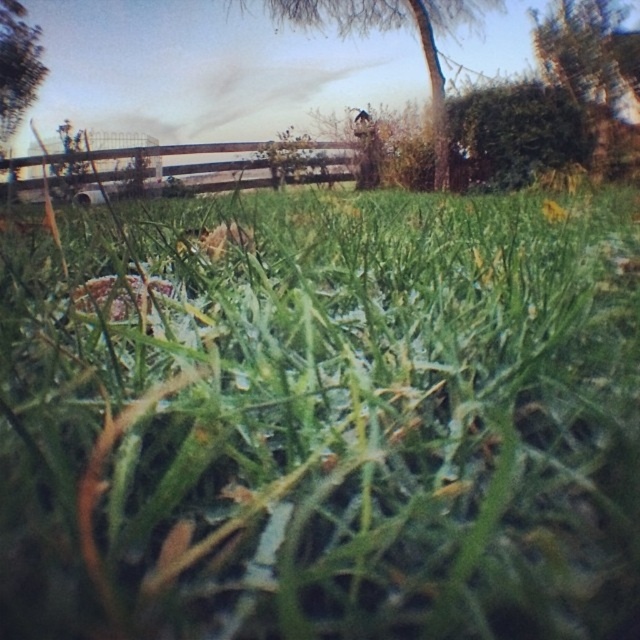
You are a photographer trying to capture both the green leafy tree at upper center and the green leafy tree at upper right in a single frame. Which tree should you focus on to ensure both are visible without cropping?

You should focus on the green leafy tree at upper center because it occupies less space than the green leafy tree at upper right, allowing both to fit within the frame.

You are a landscape architect designing a garden layout. You have two trees to place in the garden. The green leafy tree at upper center and the green leafy tree at upper left. Which tree should you choose if you want a wider tree for the garden entrance?

The green leafy tree at upper left should be chosen because its width is greater than the green leafy tree at upper center.

You are a gardener who wants to plant a new tree in the grassy area. You notice two existing trees, the green leafy tree at upper center and the green leafy tree at upper right. Which tree has a thicker trunk?

The green leafy tree at upper right has a thicker trunk than the green leafy tree at upper center.